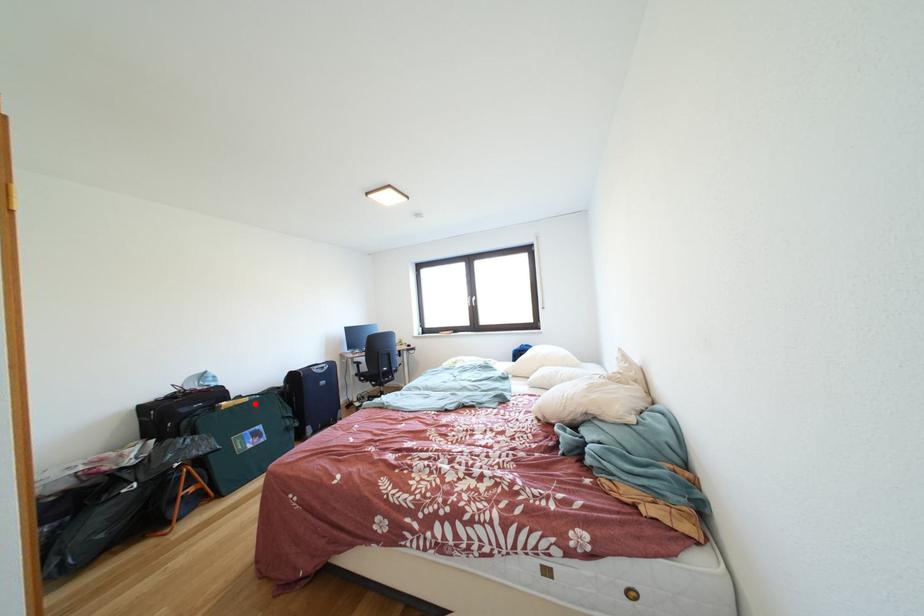
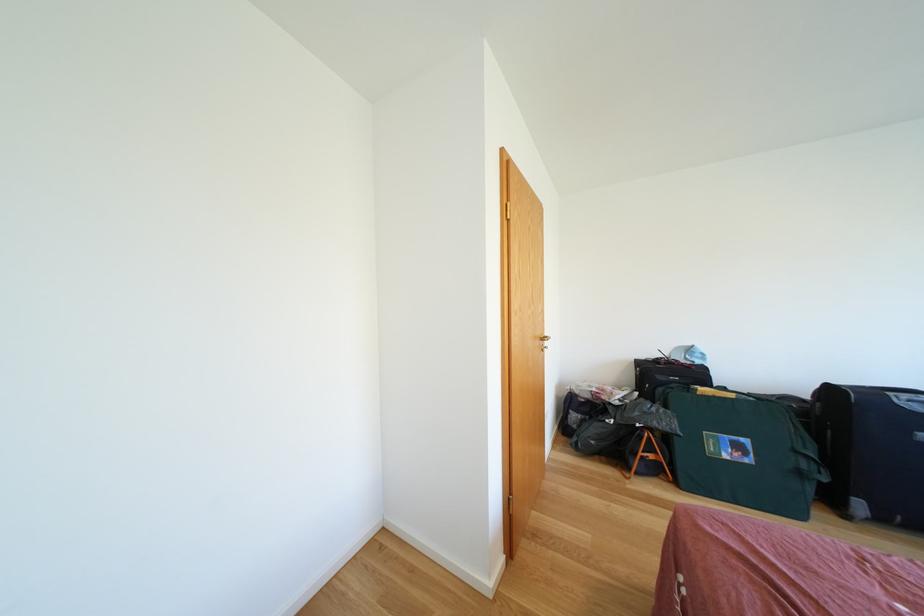
Locate, in the second image, the point that corresponds to the highlighted location in the first image.

(739, 400)